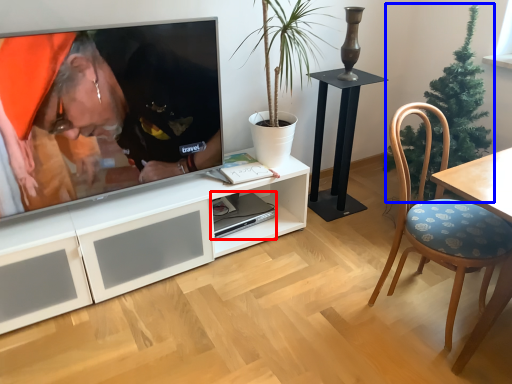
Question: Which of the following is the closest to the observer, computer (highlighted by a red box) or christmas tree (highlighted by a blue box)?

Choices:
 (A) computer
 (B) christmas tree

Answer: (B)